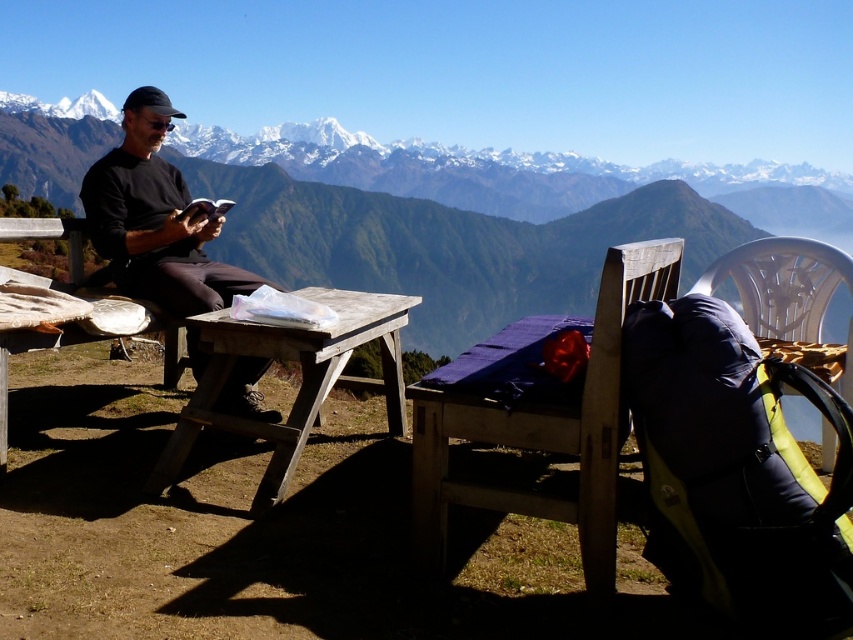
You are planning to take a photo of the snowy mountain range at upper center and the wooden chair at center. Which object should you focus on first if you want to capture both in the same frame without moving the camera?

You should focus on the snowy mountain range at upper center first because it is wider than the wooden chair at center, so it requires a wider angle to include both in the frame.

You are a photographer trying to capture the scene with the black matte shirt at left and the wooden picnic table at center. Based on their positions, which object should you focus on first if you want to include both in your shot without moving the camera?

The black matte shirt at left should be focused on first since it is positioned to the left of the wooden picnic table at center, so focusing on it ensures both objects remain in frame without needing to adjust the camera position.

What is the location of the snowy mountain range at upper center in the image?

The snowy mountain range at upper center is located at point (x=447, y=232).